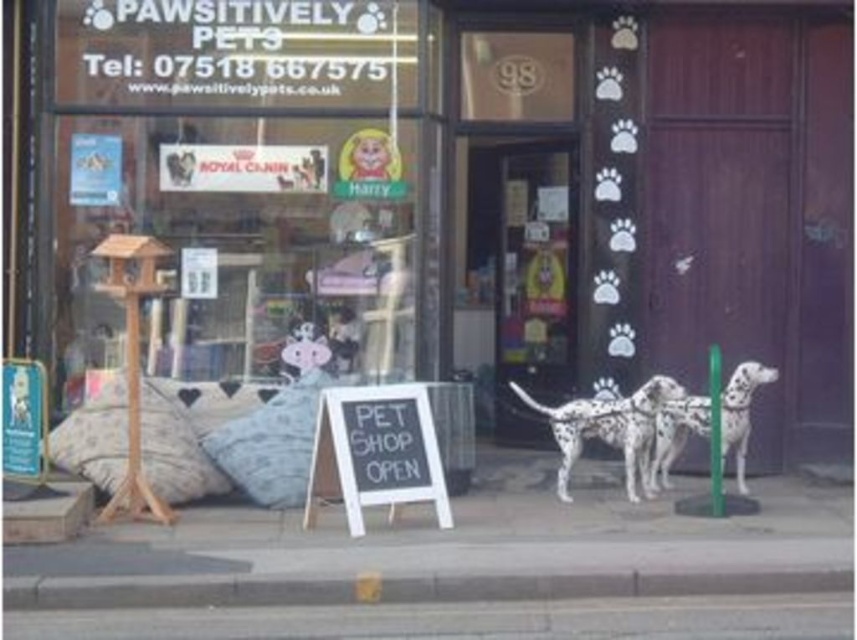
You are a delivery person approaching the PAWSITIVELY PETS store and need to place a large box in front of the storefront. The box is 1.2 meters wide. Can you fit the box between the matte glass shop window at center and the black chalkboard sign at center without overlapping either?

The matte glass shop window at center might be wider than black chalkboard sign at center, but the exact width relationship is uncertain. Therefore, it is not possible to determine if the box will fit without more specific measurements.

You are a customer standing outside the PAWSITIVELY PETS store. You see the matte glass shop window at center and the white spotted fur dog at center. Which object takes up more space in the image?

The matte glass shop window at center is bigger than the white spotted fur dog at center, so it takes up more space in the image.